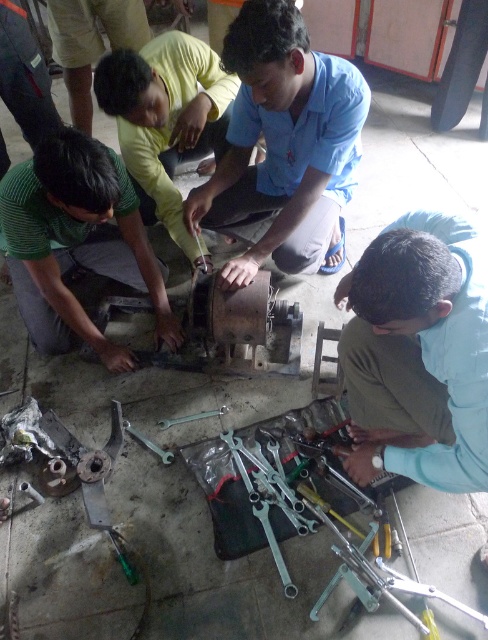
Question: Which point appears farthest from the camera in this image?

Choices:
 (A) (225, 193)
 (B) (195, 419)

Answer: (A)

Question: Does light blue shirt at lower right have a greater width compared to green matte metal tool at lower left?

Choices:
 (A) yes
 (B) no

Answer: (B)

Question: Which is nearer to the green matte metal tool at lower left?

Choices:
 (A) blue cotton shirt at center
 (B) light blue shirt at lower right
 (C) metallic wrench at center

Answer: (A)

Question: Can you confirm if yellow matte shirt at center is wider than metallic wrench at center?

Choices:
 (A) yes
 (B) no

Answer: (A)

Question: Is green matte metal tool at lower left below metallic wrench at center?

Choices:
 (A) yes
 (B) no

Answer: (B)

Question: Estimate the real-world distances between objects in this image. Which object is closer to the green matte metal tool at lower left?

Choices:
 (A) yellow matte shirt at center
 (B) light blue shirt at lower right
 (C) blue cotton shirt at center
 (D) metallic wrench at center

Answer: (A)